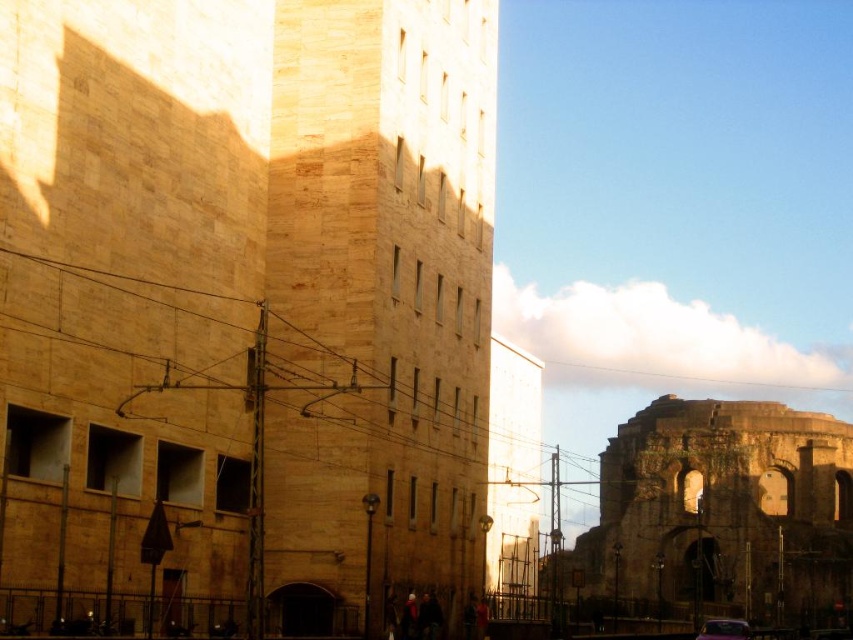
Is brown stone ruins at right shorter than metallic purple car at lower right?

Incorrect, brown stone ruins at right's height does not fall short of metallic purple car at lower right's.

Does brown stone ruins at right have a greater width compared to metallic purple car at lower right?

Yes.

Is point (677, 461) closer to camera compared to point (740, 627)?

No, it is behind (740, 627).

Locate an element on the screen. brown stone ruins at right is located at coordinates (721, 513).

Is beige stone tower at center bigger than brown stone ruins at right?

No, beige stone tower at center is not bigger than brown stone ruins at right.

Which of these two, beige stone tower at center or brown stone ruins at right, stands taller?

beige stone tower at center is taller.

Where is `beige stone tower at center`? beige stone tower at center is located at coordinates (245, 301).

You are a GUI agent. You are given a task and a screenshot of the screen. Output one action in this format:
    pyautogui.click(x=<x>, y=<y>)
    Task: Click on the beige stone tower at center
    The height and width of the screenshot is (640, 853).
    Given the screenshot: What is the action you would take?
    pyautogui.click(x=245, y=301)

Which is below, beige stone tower at center or metallic purple car at lower right?

metallic purple car at lower right

Can you confirm if beige stone tower at center is wider than metallic purple car at lower right?

Indeed, beige stone tower at center has a greater width compared to metallic purple car at lower right.

Who is more distant from viewer, [239,476] or [718,628]?

Point [718,628]

Identify the location of beige stone tower at center. (245, 301).